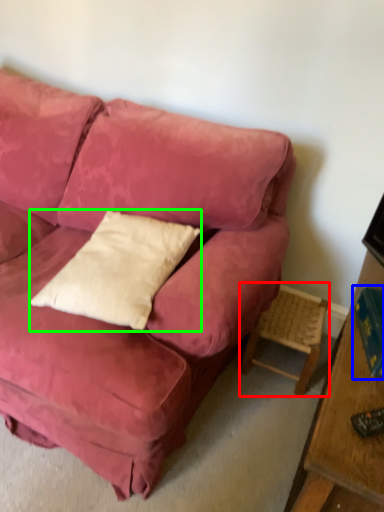
Question: Estimate the real-world distances between objects in this image. Which object is closer to side table (highlighted by a red box), book (highlighted by a blue box) or pillow (highlighted by a green box)?

Choices:
 (A) book
 (B) pillow

Answer: (A)